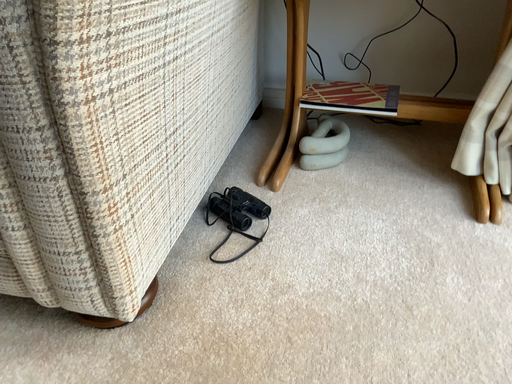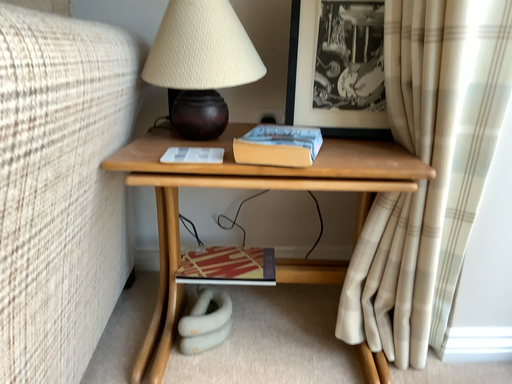
Question: Which way did the camera rotate in the video?

Choices:
 (A) rotated right
 (B) rotated left

Answer: (A)